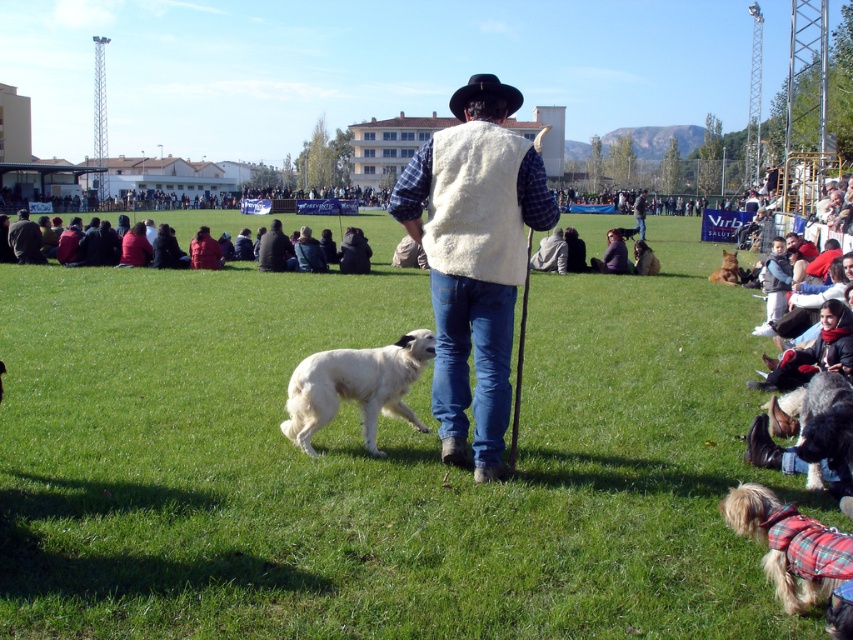
Question: Is green grass at center smaller than white fleece vest at center?

Choices:
 (A) yes
 (B) no

Answer: (B)

Question: Based on their relative distances, which object is farther from the fluffy plaid dog at lower right?

Choices:
 (A) fuzzy brown dog at lower right
 (B) black felt cowboy hat at center
 (C) fluffy white dog at lower right

Answer: (A)

Question: Considering the relative positions of white fleece vest at center and fuzzy brown dog at lower right in the image provided, where is white fleece vest at center located with respect to fuzzy brown dog at lower right?

Choices:
 (A) above
 (B) below

Answer: (A)

Question: Which point is farther to the camera?

Choices:
 (A) fuzzy brown dog at lower right
 (B) green grass at center
 (C) white fleece vest at center
 (D) white fluffy dog at center

Answer: (A)

Question: Considering the relative positions of fluffy plaid dog at lower right and fuzzy brown dog at lower right in the image provided, where is fluffy plaid dog at lower right located with respect to fuzzy brown dog at lower right?

Choices:
 (A) right
 (B) left

Answer: (B)

Question: Which object is the closest to the fluffy plaid dog at lower right?

Choices:
 (A) white fluffy dog at center
 (B) white fleece vest at center
 (C) black felt cowboy hat at center
 (D) fuzzy brown dog at lower right

Answer: (B)